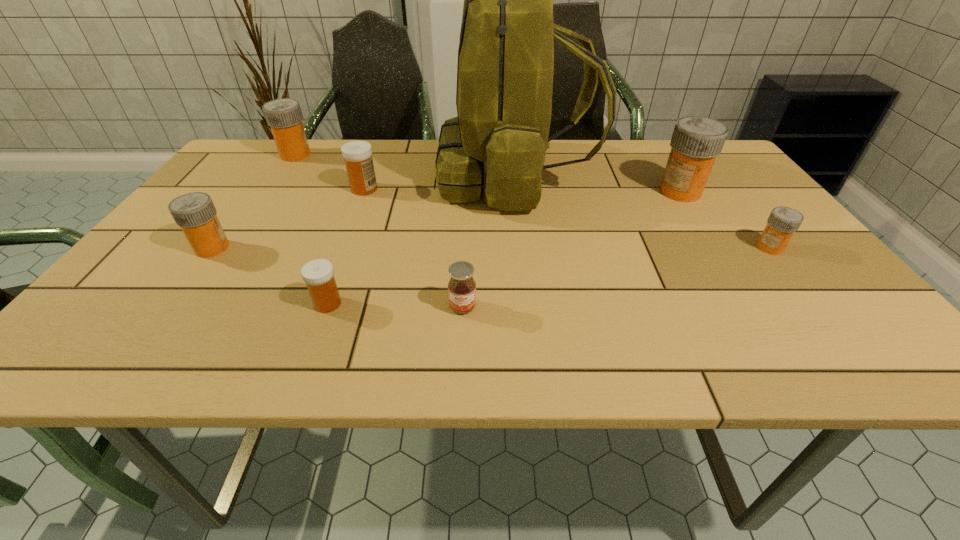
In the image, there is a desktop. Where is `vacant space at the near edge`? The width and height of the screenshot is (960, 540). vacant space at the near edge is located at coordinates (352, 338).

In order to click on free space at the left edge in this screenshot , I will do `click(167, 248)`.

Find the location of a particular element. free space at the right edge of the desktop is located at coordinates (814, 255).

This screenshot has width=960, height=540. Find the location of `free spot at the far left corner of the desktop`. free spot at the far left corner of the desktop is located at coordinates (258, 165).

Image resolution: width=960 pixels, height=540 pixels. In the image, there is a desktop. In order to click on vacant space at the near left corner in this screenshot , I will do `click(150, 345)`.

Where is `free point between the jam and the backpack`? The image size is (960, 540). free point between the jam and the backpack is located at coordinates (489, 242).

The image size is (960, 540). Identify the location of free space that is in between the third biggest orange medicine and the jam. (338, 278).

Identify the location of free space between the second orange medicine from right to left and the rightmost orange medicine. This screenshot has height=540, width=960. (725, 220).

This screenshot has height=540, width=960. Identify the location of vacant space that's between the jam and the nearer white medicine. (396, 305).

Identify the location of free spot between the farthest orange medicine and the farther white medicine. coord(330,172).